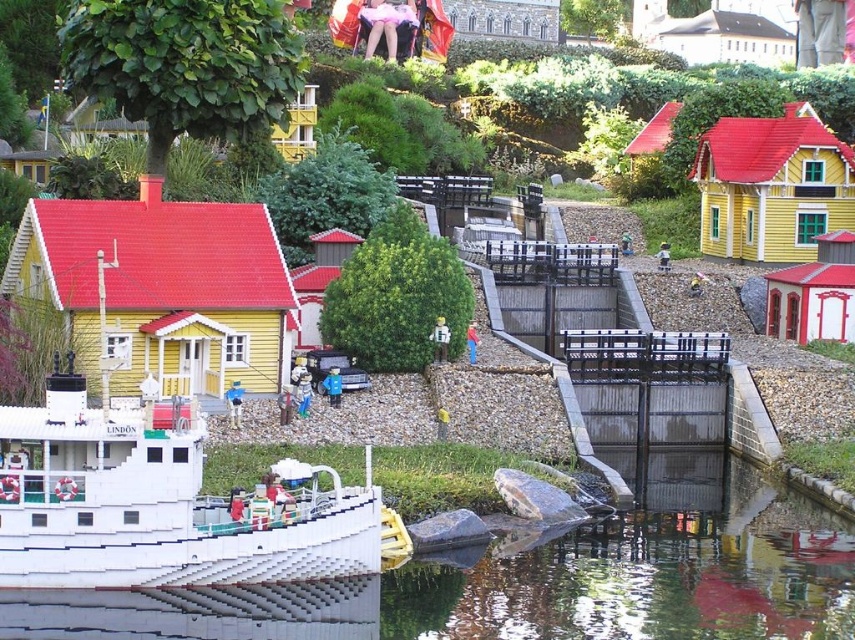
Which is more to the right, clear glass water at lower center or smooth plastic toy at center?

clear glass water at lower center is more to the right.

Which is in front, point (419, 596) or point (234, 422)?

Positioned in front is point (419, 596).

Identify the location of clear glass water at lower center. This screenshot has width=855, height=640. (647, 568).

Is point (628, 637) in front of point (325, 376)?

Yes, it is in front of point (325, 376).

I want to click on clear glass water at lower center, so click(x=647, y=568).

Does white plastic boat at center have a smaller size compared to smooth plastic toy at center?

Actually, white plastic boat at center might be larger than smooth plastic toy at center.

Is white plastic boat at center to the right of smooth plastic toy at center from the viewer's perspective?

In fact, white plastic boat at center is to the left of smooth plastic toy at center.

Which is behind, point (171, 500) or point (226, 400)?

Positioned behind is point (226, 400).

I want to click on white plastic boat at center, so click(x=160, y=502).